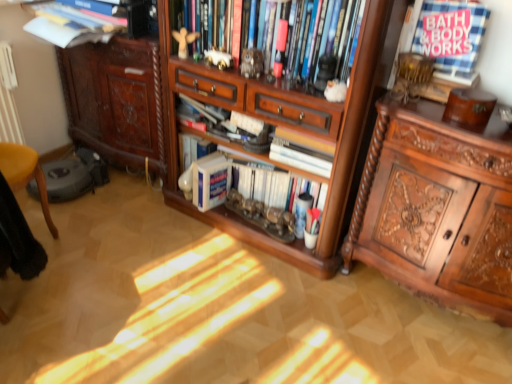
The width and height of the screenshot is (512, 384). Find the location of `vacant area that is in front of wooden cabinet at center`. vacant area that is in front of wooden cabinet at center is located at coordinates (241, 313).